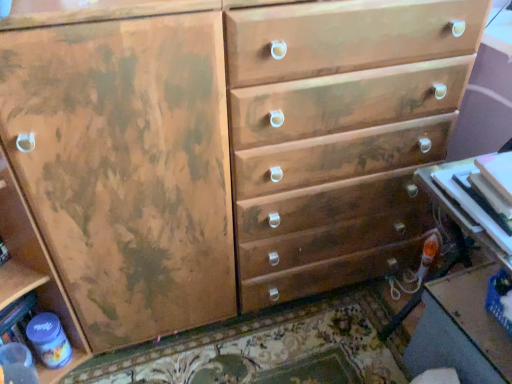
Question: Considering the relative sizes of matte plastic table at lower right, marked as the first table in a bottom-to-top arrangement, and white glossy table at lower right, positioned as the 2th table in back-to-front order, in the image provided, is matte plastic table at lower right, marked as the first table in a bottom-to-top arrangement, taller than white glossy table at lower right, positioned as the 2th table in back-to-front order,?

Choices:
 (A) yes
 (B) no

Answer: (A)

Question: Is matte plastic table at lower right, which is counted as the second table, starting from the front, positioned before white glossy table at lower right, positioned as the 2th table in back-to-front order?

Choices:
 (A) no
 (B) yes

Answer: (A)

Question: Considering the relative positions of matte plastic table at lower right, marked as the first table in a bottom-to-top arrangement, and white glossy table at lower right, positioned as the 2th table in back-to-front order, in the image provided, is matte plastic table at lower right, marked as the first table in a bottom-to-top arrangement, to the left of white glossy table at lower right, positioned as the 2th table in back-to-front order, from the viewer's perspective?

Choices:
 (A) yes
 (B) no

Answer: (B)

Question: Considering the relative sizes of matte plastic table at lower right, acting as the second table starting from the top, and white glossy table at lower right, which ranks as the 1th table in front-to-back order, in the image provided, is matte plastic table at lower right, acting as the second table starting from the top, shorter than white glossy table at lower right, which ranks as the 1th table in front-to-back order,?

Choices:
 (A) yes
 (B) no

Answer: (B)

Question: From the image's perspective, is matte plastic table at lower right, marked as the first table in a bottom-to-top arrangement, under white glossy table at lower right, the 2th table positioned from the bottom?

Choices:
 (A) yes
 (B) no

Answer: (A)

Question: Can you confirm if matte plastic table at lower right, which is counted as the second table, starting from the front, is thinner than white glossy table at lower right, the 2th table positioned from the bottom?

Choices:
 (A) yes
 (B) no

Answer: (B)

Question: Is white glossy table at lower right, positioned as the 2th table in back-to-front order, placed right next to matte plastic table at lower right, acting as the second table starting from the top?

Choices:
 (A) no
 (B) yes

Answer: (A)

Question: Is white glossy table at lower right, positioned as the 2th table in back-to-front order, thinner than matte plastic table at lower right, which is counted as the second table, starting from the front?

Choices:
 (A) no
 (B) yes

Answer: (B)

Question: Is white glossy table at lower right, the 2th table positioned from the bottom, shorter than matte plastic table at lower right, the first table when ordered from back to front?

Choices:
 (A) no
 (B) yes

Answer: (B)

Question: From the image's perspective, is white glossy table at lower right, the 2th table positioned from the bottom, under matte plastic table at lower right, acting as the second table starting from the top?

Choices:
 (A) no
 (B) yes

Answer: (A)

Question: Is white glossy table at lower right, the 2th table positioned from the bottom, further to camera compared to matte plastic table at lower right, which is counted as the second table, starting from the front?

Choices:
 (A) yes
 (B) no

Answer: (B)

Question: Is there a large distance between white glossy table at lower right, the 2th table positioned from the bottom, and matte plastic table at lower right, acting as the second table starting from the top?

Choices:
 (A) yes
 (B) no

Answer: (B)

Question: From a real-world perspective, is matte plastic bottle at lower left physically above white glossy table at lower right, the 2th table positioned from the bottom?

Choices:
 (A) yes
 (B) no

Answer: (B)